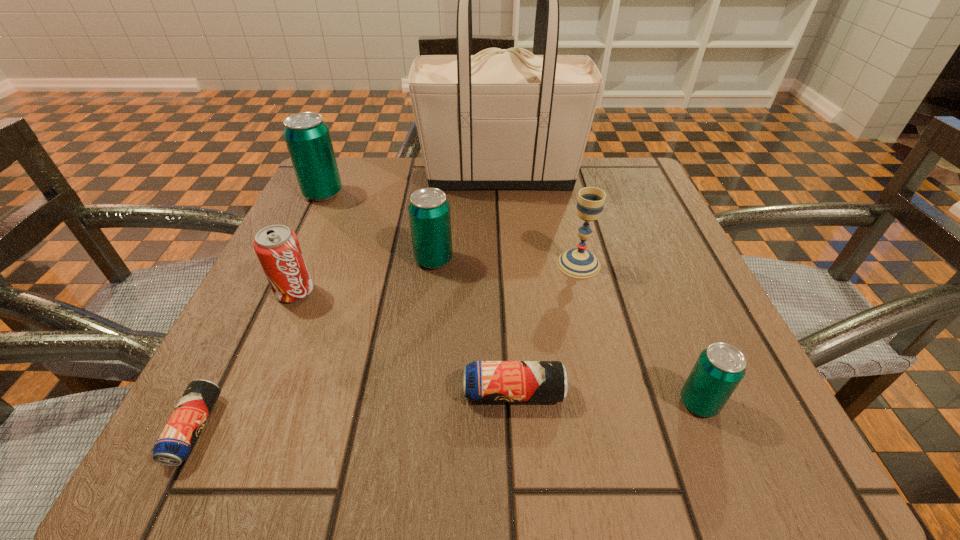
Locate an element on the screen. free point that satisfies the following two spatial constraints: 1. with handles facing forward on the gray chalice; 2. on the left side of the gray shopping bag is located at coordinates (506, 264).

I want to click on free point that satisfies the following two spatial constraints: 1. with handles facing forward on the tallest object; 2. on the front side of the smaller blue beer can, so click(517, 429).